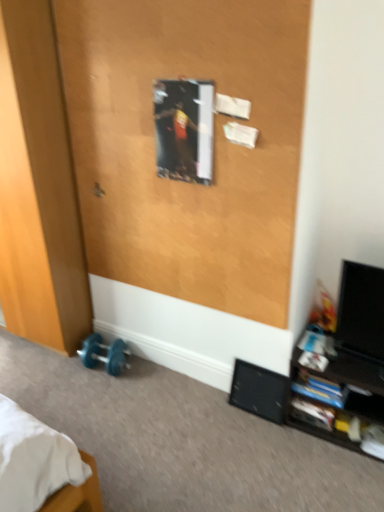
Question: Is black matte speaker at lower right not within black glossy shelf at lower right?

Choices:
 (A) no
 (B) yes

Answer: (B)

Question: Is black matte speaker at lower right looking in the opposite direction of black glossy shelf at lower right?

Choices:
 (A) yes
 (B) no

Answer: (B)

Question: Is black matte speaker at lower right closer to camera compared to black glossy shelf at lower right?

Choices:
 (A) yes
 (B) no

Answer: (B)

Question: From a real-world perspective, is black matte speaker at lower right under black glossy shelf at lower right?

Choices:
 (A) no
 (B) yes

Answer: (B)

Question: Considering the relative sizes of black matte speaker at lower right and black glossy shelf at lower right in the image provided, is black matte speaker at lower right smaller than black glossy shelf at lower right?

Choices:
 (A) no
 (B) yes

Answer: (B)

Question: In terms of size, does black glossy monitor at right appear bigger or smaller than wooden door at lower left, marked as the second screen door in a right-to-left arrangement?

Choices:
 (A) small
 (B) big

Answer: (A)

Question: Would you say black glossy monitor at right is to the left or to the right of wooden door at lower left, marked as the second screen door in a right-to-left arrangement, in the picture?

Choices:
 (A) left
 (B) right

Answer: (B)

Question: From the image's perspective, is black glossy monitor at right positioned above or below wooden door at lower left, the 1th screen door positioned from the left?

Choices:
 (A) above
 (B) below

Answer: (B)

Question: Is point (342, 308) positioned closer to the camera than point (86, 296)?

Choices:
 (A) closer
 (B) farther

Answer: (A)

Question: Does point (100, 196) appear closer or farther from the camera than point (119, 351)?

Choices:
 (A) closer
 (B) farther

Answer: (A)

Question: Is metallic silver door handle at upper center bigger or smaller than blue rubber dumbbell at lower left?

Choices:
 (A) big
 (B) small

Answer: (B)

Question: In the image, is metallic silver door handle at upper center positioned in front of or behind blue rubber dumbbell at lower left?

Choices:
 (A) front
 (B) behind

Answer: (A)

Question: From a real-world perspective, is metallic silver door handle at upper center positioned above or below blue rubber dumbbell at lower left?

Choices:
 (A) above
 (B) below

Answer: (A)

Question: Considering the positions of point (379, 318) and point (322, 409), is point (379, 318) closer or farther from the camera than point (322, 409)?

Choices:
 (A) farther
 (B) closer

Answer: (B)

Question: In terms of height, does black glossy monitor at right look taller or shorter compared to black glossy shelf at lower right?

Choices:
 (A) short
 (B) tall

Answer: (B)